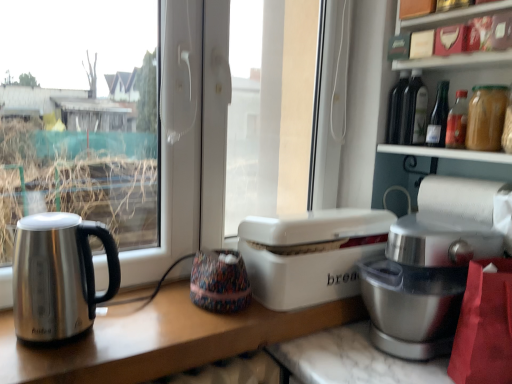
Image resolution: width=512 pixels, height=384 pixels. What are the coordinates of `empty space that is ontop of stainless steel kettle at left (from a real-world perspective)` in the screenshot? It's located at (42, 221).